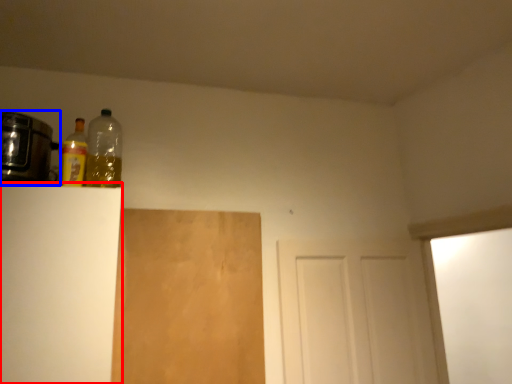
Question: Which of the following is the farthest to the observer, cabinetry (highlighted by a red box) or appliance (highlighted by a blue box)?

Choices:
 (A) cabinetry
 (B) appliance

Answer: (B)